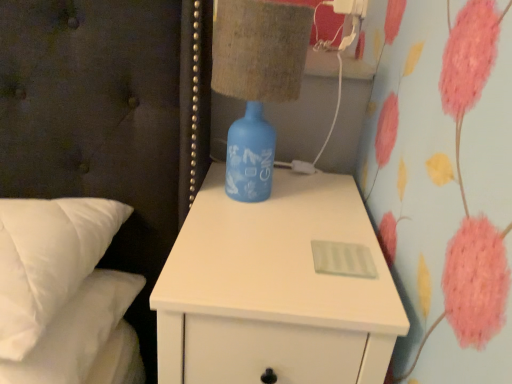
Question: Considering the positions of white matte nightstand at center and white soft pillows at left in the image, is white matte nightstand at center taller or shorter than white soft pillows at left?

Choices:
 (A) short
 (B) tall

Answer: (B)

Question: Is white matte nightstand at center to the left or to the right of white soft pillows at left in the image?

Choices:
 (A) left
 (B) right

Answer: (B)

Question: Which object is positioned farthest from the blue glass bottle at upper right?

Choices:
 (A) white plastic electric outlet at upper right
 (B) white soft pillows at left
 (C) white matte nightstand at center

Answer: (A)

Question: Which object is the closest to the white matte nightstand at center?

Choices:
 (A) white soft pillows at left
 (B) white plastic electric outlet at upper right
 (C) blue glass bottle at upper right

Answer: (C)